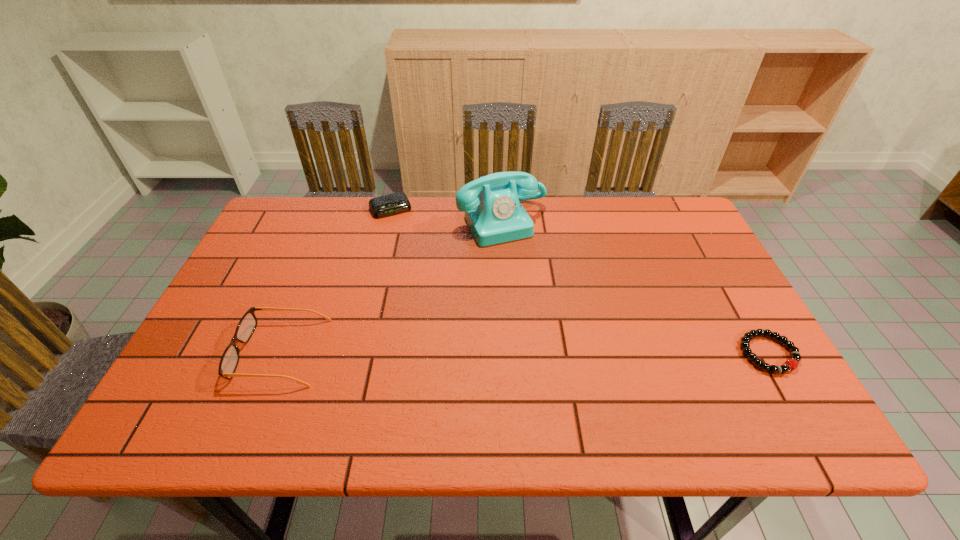
Where is `vacant space located on the front-facing side of the leftmost object`? Image resolution: width=960 pixels, height=540 pixels. vacant space located on the front-facing side of the leftmost object is located at coordinates (x=200, y=352).

You are a GUI agent. You are given a task and a screenshot of the screen. Output one action in this format:
    pyautogui.click(x=<x>, y=<y>)
    Task: Click on the free location located 0.060m on the back of the shortest object
    The width and height of the screenshot is (960, 540).
    Given the screenshot: What is the action you would take?
    pyautogui.click(x=746, y=313)

Identify the location of vacant space located 0.090m on the dial of the second object from right to left. (530, 266).

Identify the location of vacant space located 0.200m on the dial of the second object from right to left. The image size is (960, 540). (x=546, y=293).

Find the location of a particular element. Image resolution: width=960 pixels, height=540 pixels. vacant region located 0.140m on the dial of the second object from right to left is located at coordinates (537, 278).

Identify the location of free space located 0.280m on the display of the third tallest object. (425, 275).

You are a GUI agent. You are given a task and a screenshot of the screen. Output one action in this format:
    pyautogui.click(x=<x>, y=<y>)
    Task: Click on the vacant space located on the display of the third tallest object
    This screenshot has height=540, width=960.
    Given the screenshot: What is the action you would take?
    pyautogui.click(x=425, y=275)

Where is `free space located on the display of the third tallest object`? free space located on the display of the third tallest object is located at coordinates (413, 251).

At what (x,y) coordinates should I click in order to perform the action: click on telephone located in the far edge section of the desktop. Please return your answer as a coordinate pair (x, y). The width and height of the screenshot is (960, 540). Looking at the image, I should click on (493, 212).

At what (x,y) coordinates should I click in order to perform the action: click on alarm clock that is at the far edge. Please return your answer as a coordinate pair (x, y). This screenshot has width=960, height=540. Looking at the image, I should click on (391, 204).